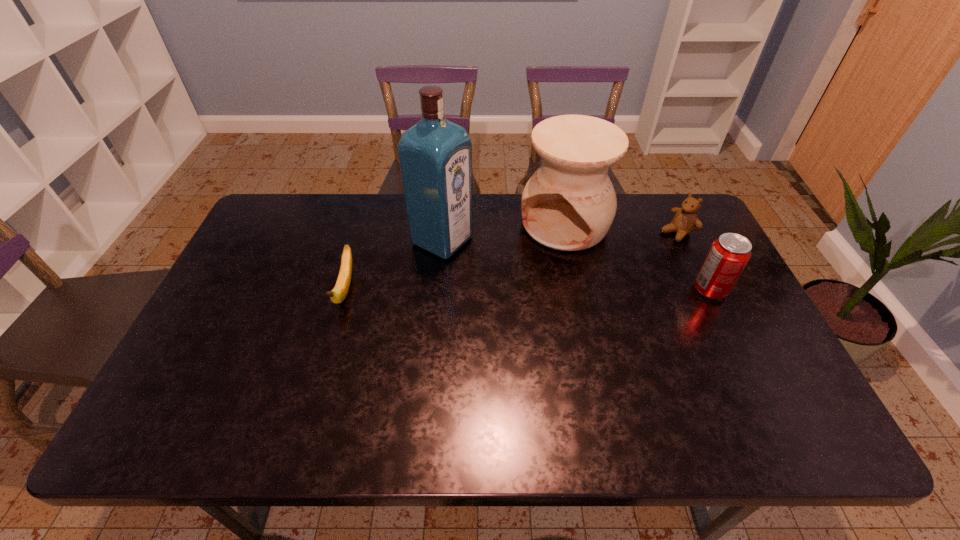
The height and width of the screenshot is (540, 960). Identify the location of vacant space located 0.190m at the open side of the pottery. (517, 289).

You are a GUI agent. You are given a task and a screenshot of the screen. Output one action in this format:
    pyautogui.click(x=<x>, y=<y>)
    Task: Click on the vacant region located at the open side of the pottery
    The image size is (960, 540).
    Given the screenshot: What is the action you would take?
    pyautogui.click(x=513, y=296)

Locate an element on the screen. free region located 0.050m at the open side of the pottery is located at coordinates (539, 260).

Locate an element on the screen. The height and width of the screenshot is (540, 960). vacant area located 0.060m on the flat label side of the tallest object is located at coordinates (484, 260).

Find the location of a particular element. This screenshot has width=960, height=540. blank space located 0.390m on the flat label side of the tallest object is located at coordinates pyautogui.click(x=584, y=308).

You are a GUI agent. You are given a task and a screenshot of the screen. Output one action in this format:
    pyautogui.click(x=<x>, y=<y>)
    Task: Click on the free location located 0.320m on the flat label side of the tallest object
    Image resolution: width=960 pixels, height=540 pixels.
    Given the screenshot: What is the action you would take?
    pyautogui.click(x=561, y=297)

Find the location of a particular element. The width and height of the screenshot is (960, 540). vacant space located 0.380m on the front-facing side of the teddy bear is located at coordinates (579, 290).

Locate an element on the screen. This screenshot has height=540, width=960. free region located 0.110m on the front-facing side of the teddy bear is located at coordinates (643, 252).

Find the location of a particular element. free location located on the front-facing side of the teddy bear is located at coordinates (618, 267).

What are the coordinates of `pottery at the far edge` in the screenshot? It's located at (569, 203).